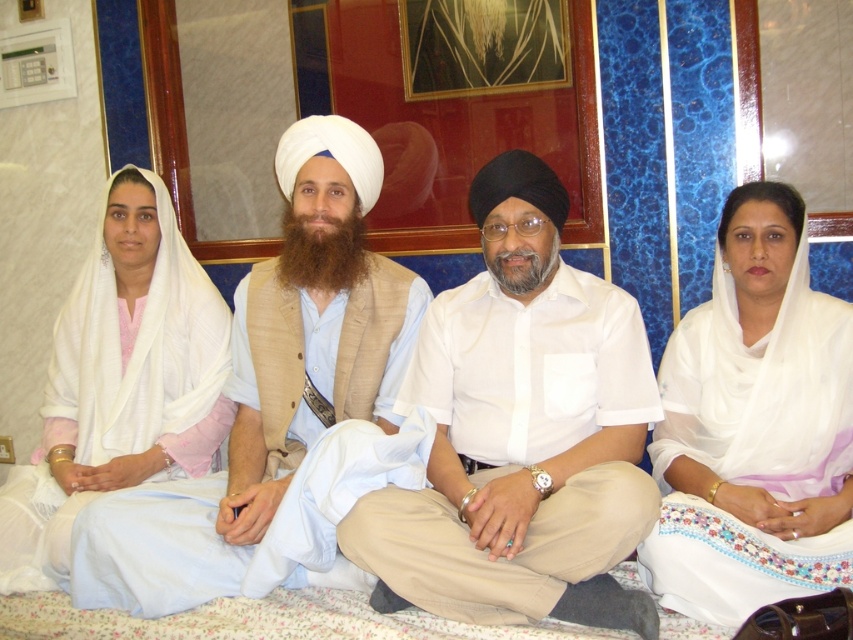
Does white cotton robe at center have a lesser width compared to white satin shawl at left?

No.

Measure the distance between white cotton robe at center and camera.

white cotton robe at center and camera are 6.32 feet apart.

Image resolution: width=853 pixels, height=640 pixels. I want to click on white cotton robe at center, so click(x=271, y=456).

Is white sheer scarf at right smaller than white cotton robe at center?

Yes.

This screenshot has width=853, height=640. Describe the element at coordinates (753, 426) in the screenshot. I see `white sheer scarf at right` at that location.

Where is `white sheer scarf at right`? This screenshot has width=853, height=640. white sheer scarf at right is located at coordinates (753, 426).

Locate an element on the screen. The height and width of the screenshot is (640, 853). white sheer scarf at right is located at coordinates (753, 426).

Does white sheer scarf at right appear on the right side of white satin shawl at left?

Indeed, white sheer scarf at right is positioned on the right side of white satin shawl at left.

Which is behind, point (772, 461) or point (138, 401)?

Point (138, 401)

I want to click on white sheer scarf at right, so coord(753,426).